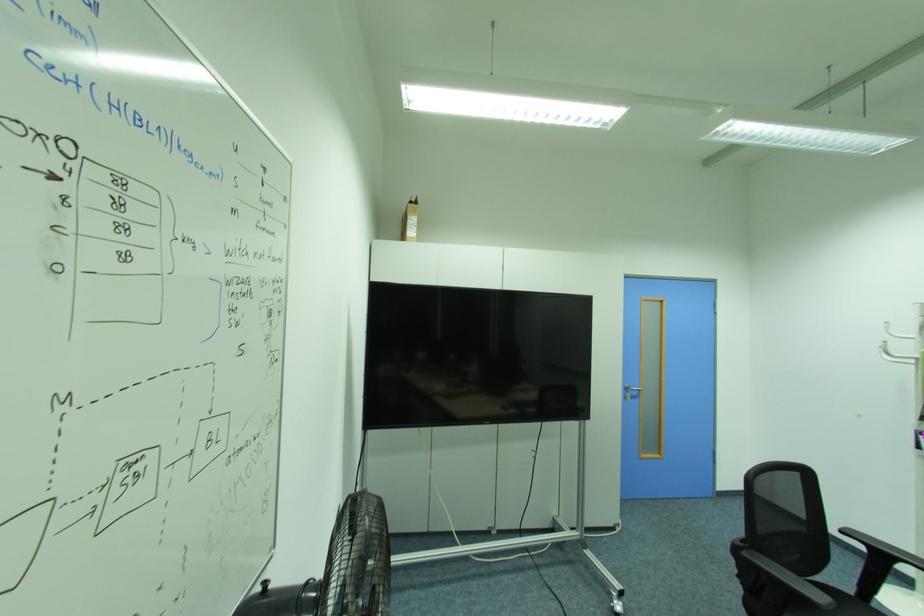
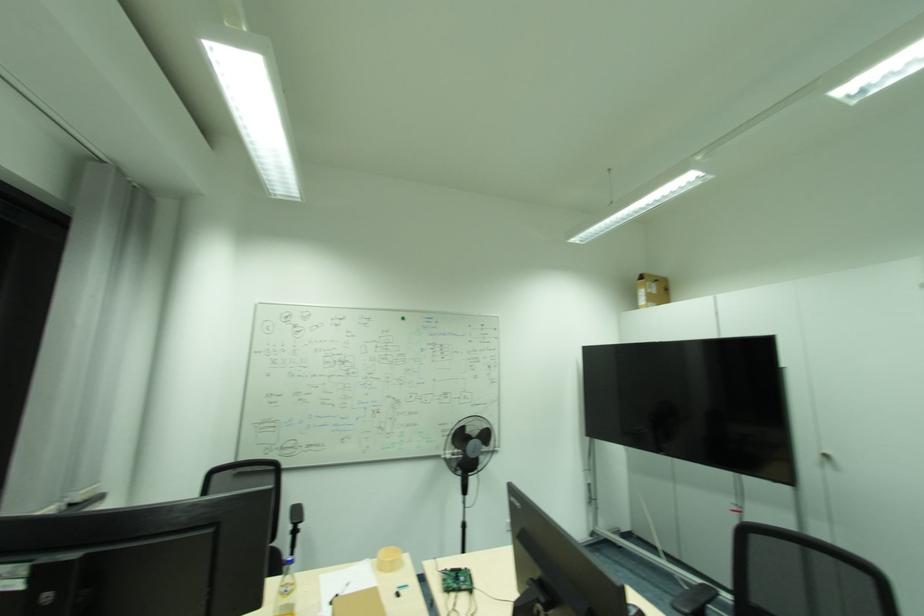
In the second image, find the point that corresponds to [407,237] in the first image.

(639, 307)